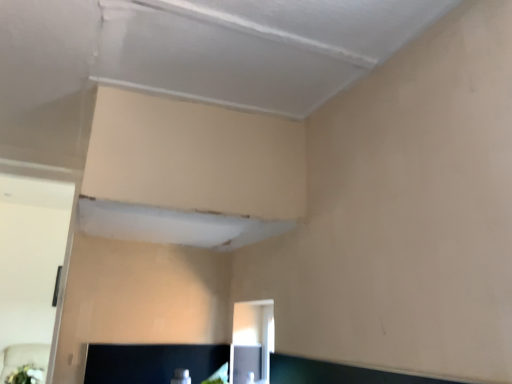
What is the approximate width of green leafy plant at lower left?

12.76 inches.

Locate an element on the screen. This screenshot has width=512, height=384. green leafy plant at lower left is located at coordinates (25, 375).

The image size is (512, 384). What do you see at coordinates (25, 375) in the screenshot?
I see `green leafy plant at lower left` at bounding box center [25, 375].

Where is `green leafy plant at lower left`? The height and width of the screenshot is (384, 512). green leafy plant at lower left is located at coordinates (25, 375).